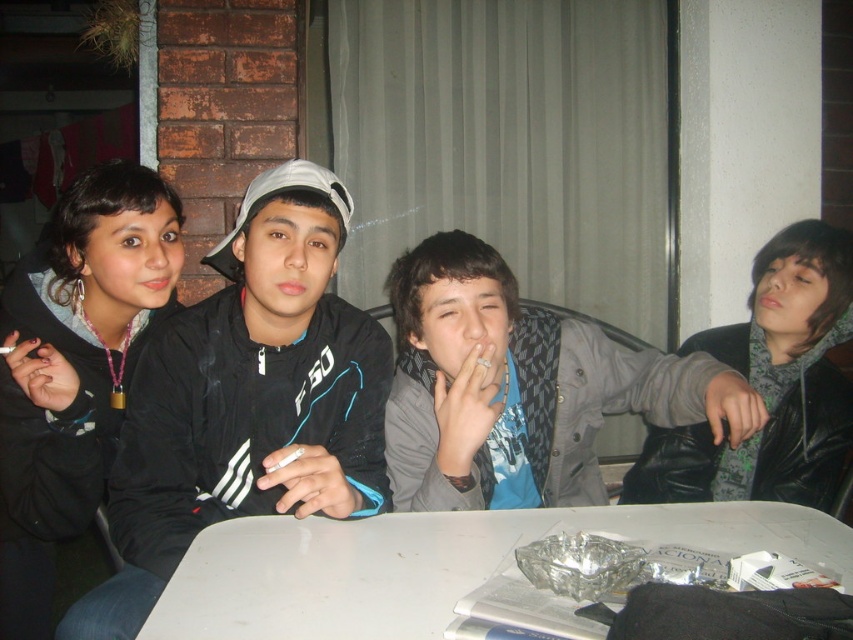
Question: Does black matte jacket at center appear under white plastic table at lower center?

Choices:
 (A) no
 (B) yes

Answer: (A)

Question: Does black matte jacket at center come behind white plastic table at lower center?

Choices:
 (A) yes
 (B) no

Answer: (A)

Question: Which point is closer to the camera taking this photo?

Choices:
 (A) (338, 337)
 (B) (485, 259)
 (C) (270, 544)

Answer: (C)

Question: Where is black matte jacket at center located in relation to white plastic table at lower center in the image?

Choices:
 (A) above
 (B) below

Answer: (A)

Question: Which point is farther from the camera taking this photo?

Choices:
 (A) (642, 369)
 (B) (273, 636)

Answer: (A)

Question: Which point is closer to the camera?

Choices:
 (A) white plastic table at lower center
 (B) gray matte jacket at center

Answer: (A)